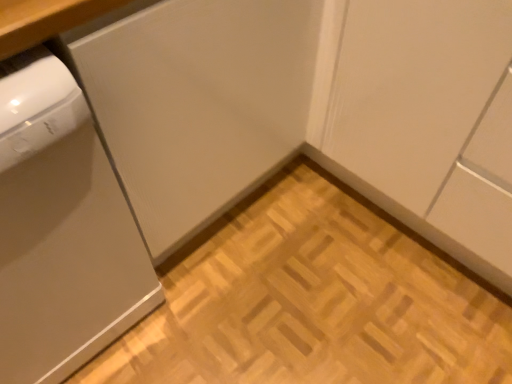
Identify the location of satin white dishwasher at left. (61, 229).

The image size is (512, 384). What do you see at coordinates (61, 229) in the screenshot?
I see `satin white dishwasher at left` at bounding box center [61, 229].

Consider the image. In order to face satin white dishwasher at left, should I rotate leftwards or rightwards?

You should rotate left by 32.109 degrees.

Identify the location of satin white dishwasher at left. pyautogui.click(x=61, y=229).